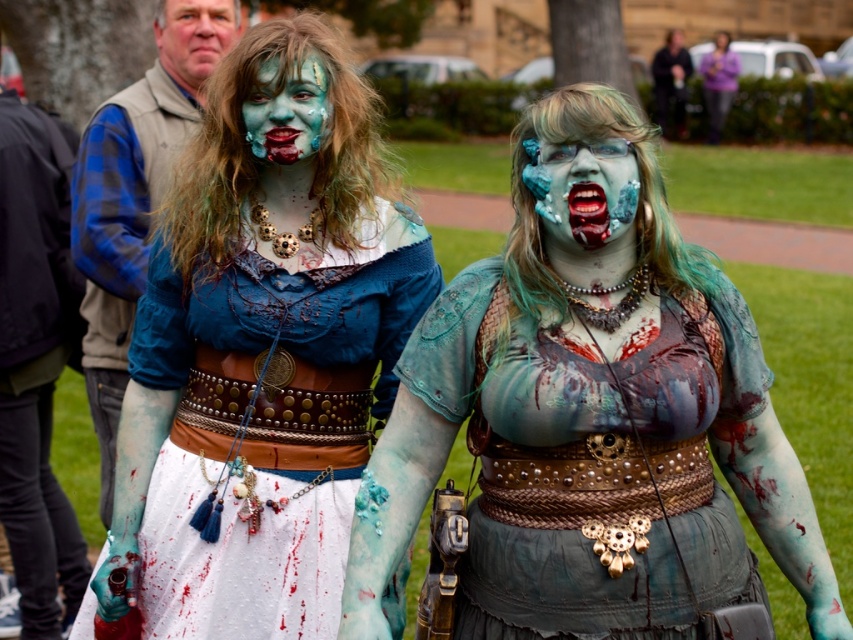
You are a photographer trying to capture the matte blue fabric dress at center and the purple fabric at upper right in a single shot. Which object should you focus on first to ensure both are in frame?

You should focus on the matte blue fabric dress at center first since it is in front of the purple fabric at upper right, allowing both to be captured in the frame.

Consider the image. You are a costume designer observing the two elements in the image. The matte skin face at upper left and the purple fabric at upper right are both part of the costumes. Which of these two elements has a smaller width?

The matte skin face at upper left is thinner than the purple fabric at upper right, so the matte skin face at upper left has a smaller width.